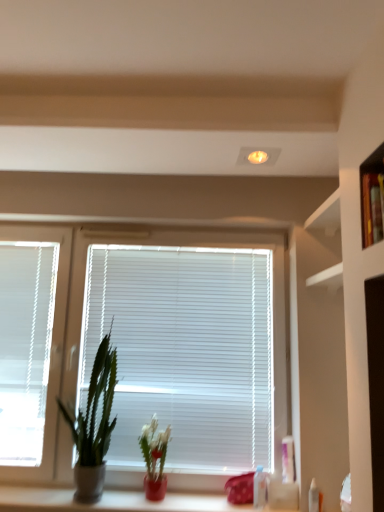
Question: Should I look upward or downward to see white glossy counter at lower center?

Choices:
 (A) up
 (B) down

Answer: (B)

Question: From the image's perspective, would you say white plastic blinds at center is positioned over white plastic bottle at lower right, the 2th toiletry when ordered from left to right?

Choices:
 (A) no
 (B) yes

Answer: (B)

Question: From a real-world perspective, is white plastic blinds at center physically above white plastic bottle at lower right, which is the second toiletry in back-to-front order?

Choices:
 (A) no
 (B) yes

Answer: (B)

Question: Can you confirm if white plastic blinds at center is positioned to the left of white plastic bottle at lower right, the first toiletry in the right-to-left sequence?

Choices:
 (A) no
 (B) yes

Answer: (B)

Question: Does white plastic blinds at center have a larger size compared to white plastic bottle at lower right, which is the second toiletry in back-to-front order?

Choices:
 (A) no
 (B) yes

Answer: (B)

Question: Would you say white plastic blinds at center is outside white plastic bottle at lower right, the first toiletry positioned from the front?

Choices:
 (A) no
 (B) yes

Answer: (B)

Question: Is white plastic blinds at center facing away from white plastic bottle at lower right, which is the second toiletry in back-to-front order?

Choices:
 (A) yes
 (B) no

Answer: (B)

Question: From a real-world perspective, does green matte plant at left, which ranks as the 1th houseplant in left-to-right order, sit lower than matte ceramic plant at lower center, which appears as the second houseplant when viewed from the left?

Choices:
 (A) no
 (B) yes

Answer: (A)

Question: Does green matte plant at left, the second houseplant in the right-to-left sequence, have a lesser width compared to matte ceramic plant at lower center, which appears as the second houseplant when viewed from the left?

Choices:
 (A) no
 (B) yes

Answer: (A)

Question: Does green matte plant at left, the second houseplant in the right-to-left sequence, have a lesser height compared to matte ceramic plant at lower center, which appears as the second houseplant when viewed from the left?

Choices:
 (A) yes
 (B) no

Answer: (B)

Question: Is green matte plant at left, the second houseplant in the right-to-left sequence, at the right side of matte ceramic plant at lower center, placed as the first houseplant when sorted from right to left?

Choices:
 (A) yes
 (B) no

Answer: (B)

Question: Considering the relative sizes of green matte plant at left, which ranks as the 1th houseplant in left-to-right order, and matte ceramic plant at lower center, placed as the first houseplant when sorted from right to left, in the image provided, is green matte plant at left, which ranks as the 1th houseplant in left-to-right order, taller than matte ceramic plant at lower center, placed as the first houseplant when sorted from right to left,?

Choices:
 (A) yes
 (B) no

Answer: (A)

Question: Is green matte plant at left, the second houseplant in the right-to-left sequence, positioned behind matte ceramic plant at lower center, placed as the first houseplant when sorted from right to left?

Choices:
 (A) no
 (B) yes

Answer: (A)

Question: Considering the relative sizes of green matte plant at left, the second houseplant in the right-to-left sequence, and white plastic blinds at left in the image provided, is green matte plant at left, the second houseplant in the right-to-left sequence, wider than white plastic blinds at left?

Choices:
 (A) yes
 (B) no

Answer: (A)